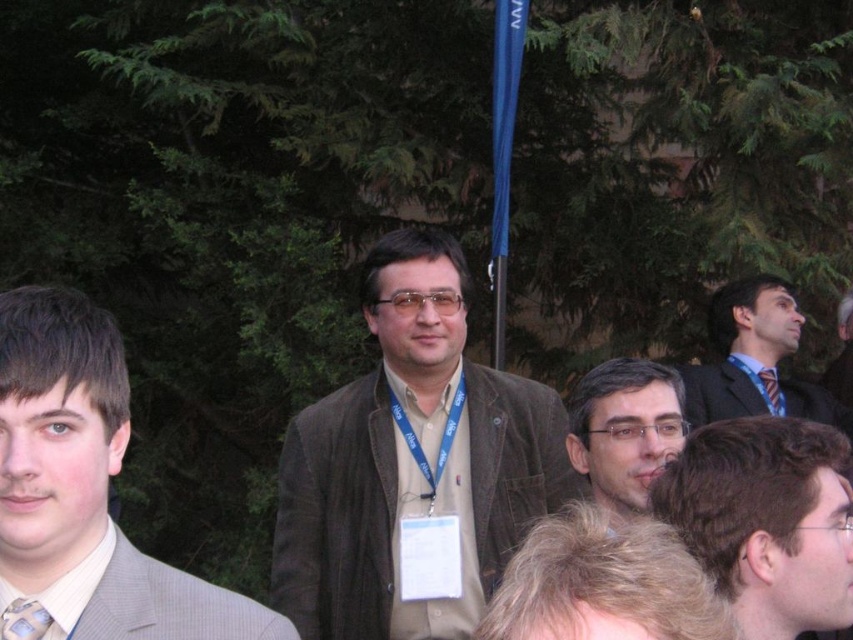
Is light beige checkered suit at lower left bigger than dark blue suit at center?

Incorrect, light beige checkered suit at lower left is not larger than dark blue suit at center.

Is point (178, 573) in front of point (798, 401)?

Yes, it is.

Where is `light beige checkered suit at lower left`? light beige checkered suit at lower left is located at coordinates (170, 605).

Is matte brown hair at center closer to camera compared to dark blue suit at center?

Yes, it is in front of dark blue suit at center.

Between point (665, 456) and point (792, 394), which one is positioned behind?

Positioned behind is point (792, 394).

What do you see at coordinates (625, 429) in the screenshot?
I see `matte brown hair at center` at bounding box center [625, 429].

Image resolution: width=853 pixels, height=640 pixels. In order to click on matte brown hair at center in this screenshot , I will do pos(625,429).

Which is above, smooth brown hair at center or matte brown hair at center?

smooth brown hair at center is higher up.

Where is `smooth brown hair at center`? The image size is (853, 640). smooth brown hair at center is located at coordinates (764, 520).

This screenshot has height=640, width=853. In order to click on smooth brown hair at center in this screenshot , I will do `click(764, 520)`.

The image size is (853, 640). In order to click on smooth brown hair at center in this screenshot , I will do `click(764, 520)`.